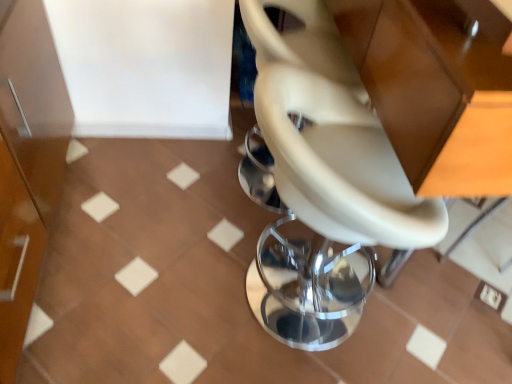
The image size is (512, 384). I want to click on white glossy toilet at center, so click(x=324, y=182).

Describe the element at coordinates (324, 182) in the screenshot. I see `white glossy toilet at center` at that location.

Where is `white glossy toilet at center`? This screenshot has height=384, width=512. white glossy toilet at center is located at coordinates (324, 182).